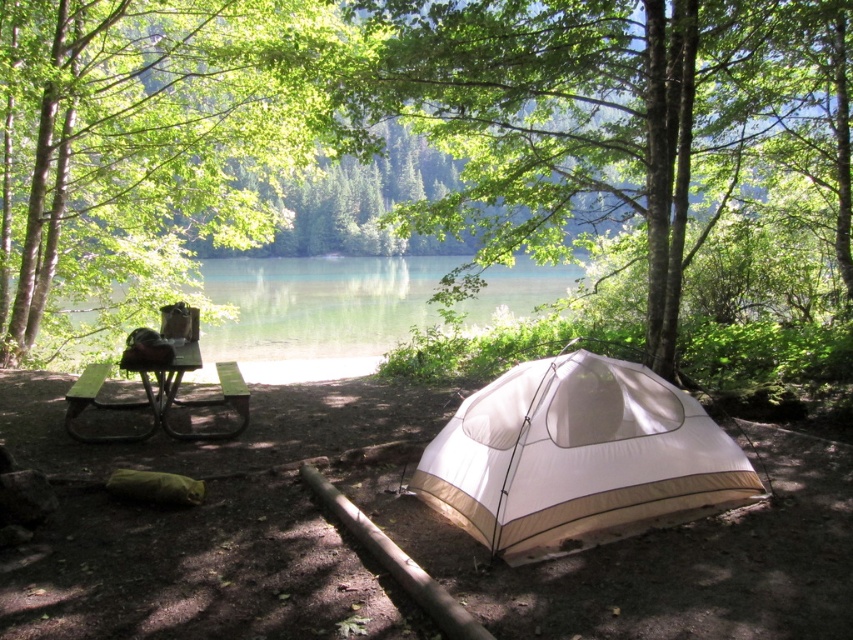
Consider the image. Can you confirm if green leafy tree at left is shorter than green painted wood picnic table at center-left?

Incorrect, green leafy tree at left's height does not fall short of green painted wood picnic table at center-left's.

Is green leafy tree at left below green painted wood picnic table at center-left?

Incorrect, green leafy tree at left is not positioned below green painted wood picnic table at center-left.

Which is behind, point (251, 104) or point (183, 305)?

The point (251, 104) is behind.

Where is `green leafy tree at left`? This screenshot has height=640, width=853. green leafy tree at left is located at coordinates (151, 140).

This screenshot has width=853, height=640. In order to click on clear water at center in this screenshot , I will do `click(318, 305)`.

Between point (218, 278) and point (247, 392), which one is positioned in front?

Positioned in front is point (247, 392).

Where is `clear water at center`? The width and height of the screenshot is (853, 640). clear water at center is located at coordinates (318, 305).

Locate an element on the screen. The height and width of the screenshot is (640, 853). clear water at center is located at coordinates (318, 305).

How much distance is there between green leafy tree at left and clear water at center?

The distance of green leafy tree at left from clear water at center is 5.21 meters.

Does point (45, 83) come behind point (323, 282)?

No, (45, 83) is in front of (323, 282).

What are the coordinates of `green leafy tree at left` in the screenshot? It's located at point(151,140).